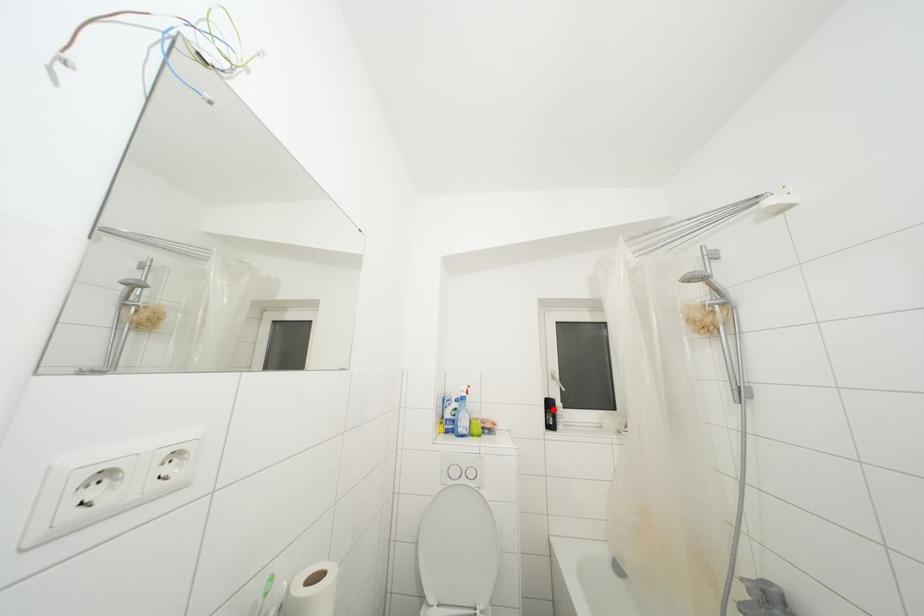
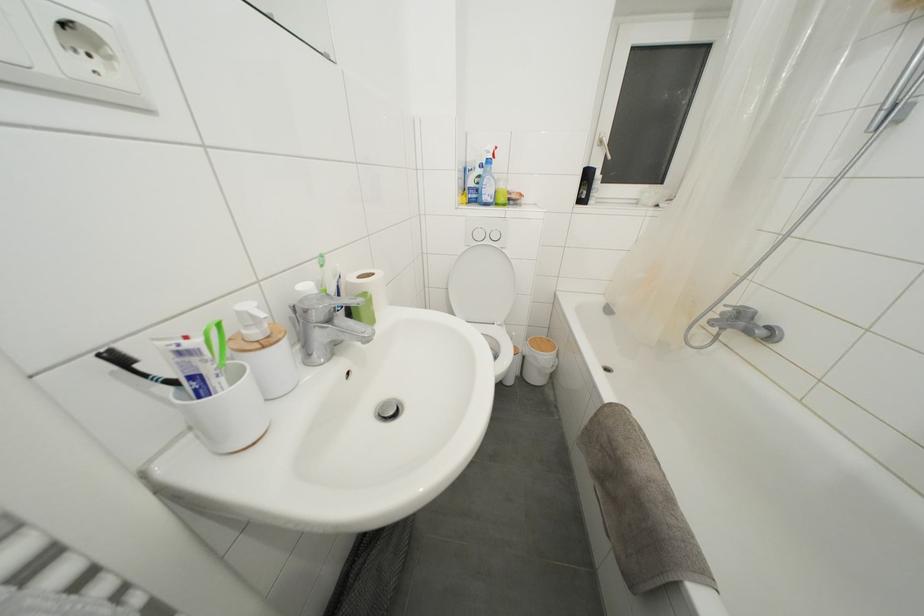
The point at the highlighted location is marked in the first image. Where is the corresponding point in the second image?

(591, 180)